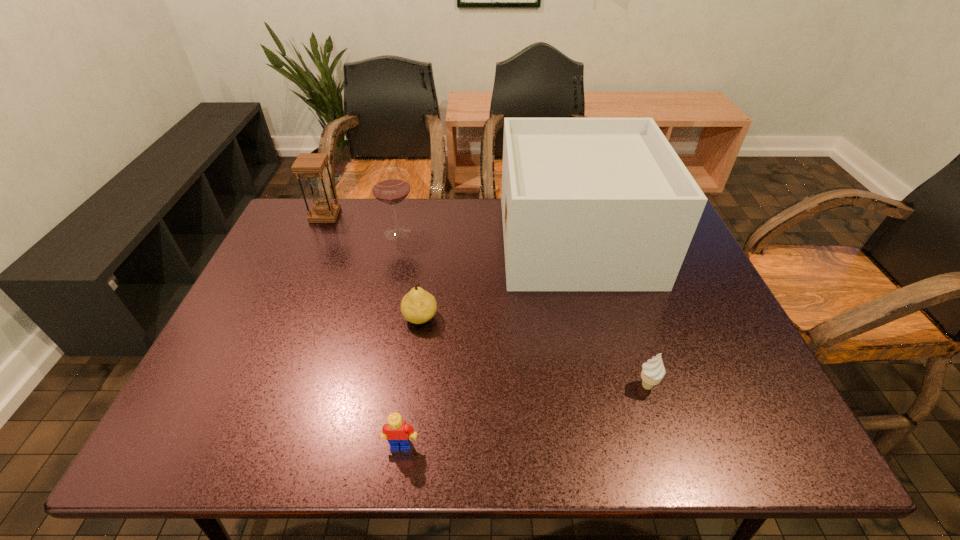
Find the location of `free spot between the pear and the box`. free spot between the pear and the box is located at coordinates point(498,279).

Identify the location of free space between the fifth farthest object and the hourglass. (486, 301).

Identify the location of free point between the icecream and the box. This screenshot has height=540, width=960. (612, 313).

Identify the location of empty space that is in between the Lego and the fourth farthest object. This screenshot has height=540, width=960. (411, 381).

The height and width of the screenshot is (540, 960). In order to click on free space between the hourglass and the tallest object in this screenshot , I will do `click(450, 228)`.

At what (x,y) coordinates should I click in order to perform the action: click on vacant area that lies between the nearest object and the box. Please return your answer as a coordinate pair (x, y). Looking at the image, I should click on (489, 343).

Where is `the third closest object relative to the icecream`? the third closest object relative to the icecream is located at coordinates [x=398, y=433].

Point out which object is positioned as the third nearest to the tallest object. Please provide its 2D coordinates. Your answer should be formatted as a tuple, i.e. [(x, y)], where the tuple contains the x and y coordinates of a point satisfying the conditions above.

[(390, 186)]